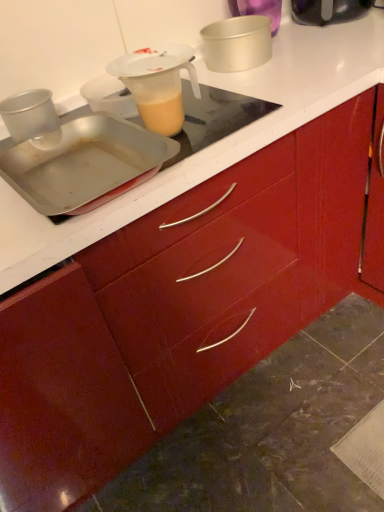
Question: From the image's perspective, relative to metallic silver cake pan at upper center, which is counted as the third kitchen appliance, starting from the bottom, is translucent plastic jug at upper center above or below?

Choices:
 (A) above
 (B) below

Answer: (B)

Question: Based on their positions, is translucent plastic jug at upper center located to the left or right of metallic silver cake pan at upper center, the second kitchen appliance when ordered from right to left?

Choices:
 (A) right
 (B) left

Answer: (B)

Question: Which of these objects is positioned farthest from the metallic silver cake pan at upper center, which is counted as the third kitchen appliance, starting from the bottom?

Choices:
 (A) black plastic toaster at upper right, positioned as the fourth kitchen appliance in left-to-right order
 (B) metallic silver tray at upper left, arranged as the fourth kitchen appliance when viewed from the top
 (C) metallic silver cup at left, positioned as the third kitchen appliance in top-to-bottom order
 (D) translucent plastic jug at upper center

Answer: (C)

Question: Which object is positioned farthest from the metallic silver cake pan at upper center, the third kitchen appliance in the left-to-right sequence?

Choices:
 (A) black plastic toaster at upper right, which is the 4th kitchen appliance in bottom-to-top order
 (B) translucent plastic jug at upper center
 (C) metallic silver cup at left, positioned as the third kitchen appliance in top-to-bottom order
 (D) metallic silver tray at upper left, which ranks as the 1th kitchen appliance in bottom-to-top order

Answer: (C)